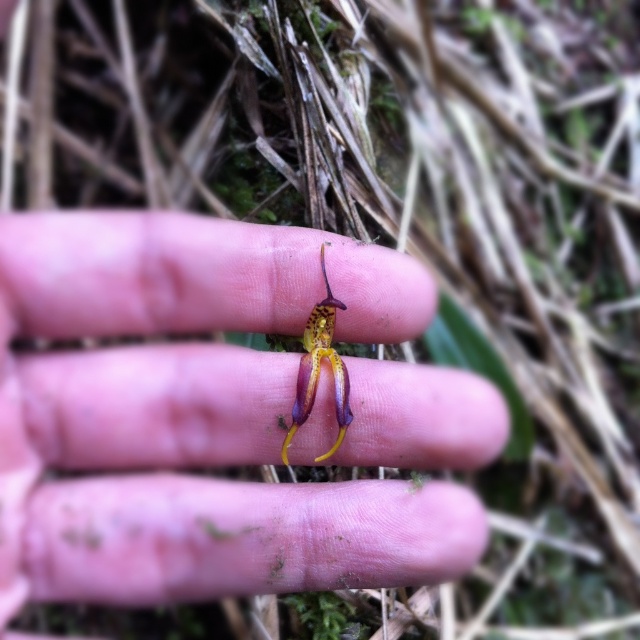
You are a photographer trying to capture the flower in the image. You notice two points marked in the scene. Which point is closer to the camera? The points are point [227,582] and point [321,310].

Point [227,582] is in front of point [321,310], so it is closer to the camera.

The image shows a hand holding a flower. There is a specific point labeled at coordinates point (195, 416). What object is located at that point?

The point (195, 416) corresponds to the matte yellow flower at center.